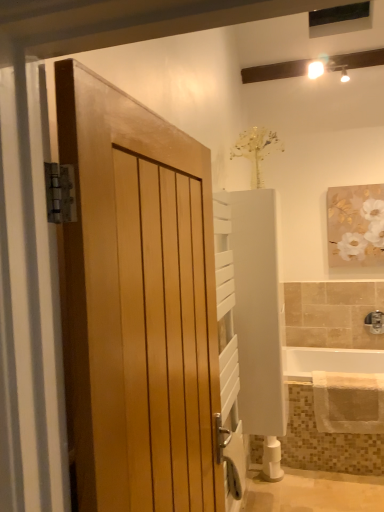
Question: Would you say white glossy bathtub at lower right is to the left or to the right of beige textured bath towel at lower right in the picture?

Choices:
 (A) right
 (B) left

Answer: (A)

Question: Is white glossy bathtub at lower right inside the boundaries of beige textured bath towel at lower right, or outside?

Choices:
 (A) outside
 (B) inside

Answer: (A)

Question: Which object is the farthest from the white matte toilet paper at lower center?

Choices:
 (A) beige textured bath towel at lower right
 (B) white glossy bathtub at lower right
 (C) natural wood door at left
 (D) white matte radiator at center
 (E) satin nickel faucet at lower right

Answer: (C)

Question: Which object is positioned closest to the beige textured bath towel at lower right?

Choices:
 (A) satin nickel faucet at lower right
 (B) white matte radiator at center
 (C) white matte painting at upper right
 (D) natural wood door at left
 (E) white matte toilet paper at lower center

Answer: (E)